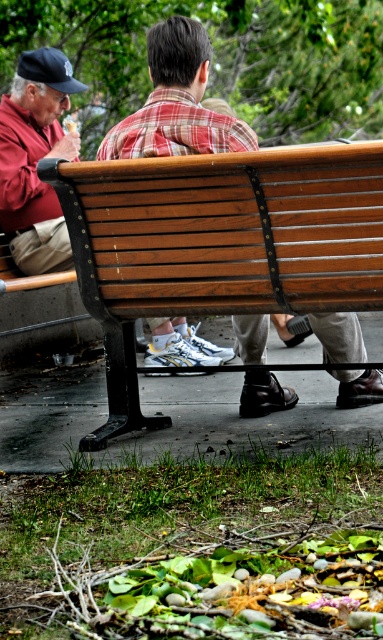
Question: From the image, what is the correct spatial relationship of wooden bench at center in relation to matte red shirt at left?

Choices:
 (A) below
 (B) above

Answer: (B)

Question: Can you confirm if wooden bench at center is positioned to the right of matte red shirt at left?

Choices:
 (A) no
 (B) yes

Answer: (B)

Question: Does wooden bench at center lie behind matte red shirt at left?

Choices:
 (A) no
 (B) yes

Answer: (A)

Question: Which point is closer to the camera?

Choices:
 (A) (170, 120)
 (B) (6, 227)

Answer: (A)

Question: Among these points, which one is farthest from the camera?

Choices:
 (A) (335, 358)
 (B) (65, 106)

Answer: (B)